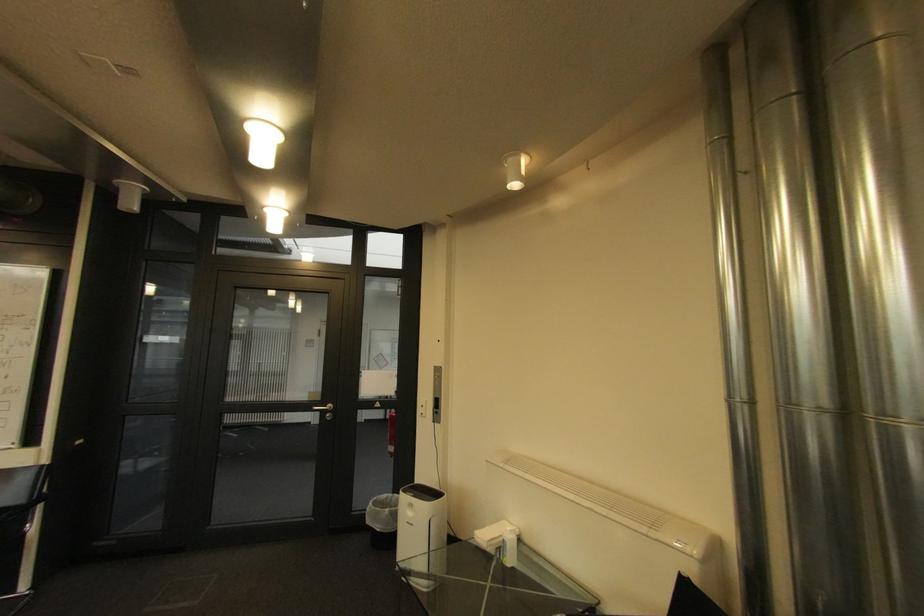
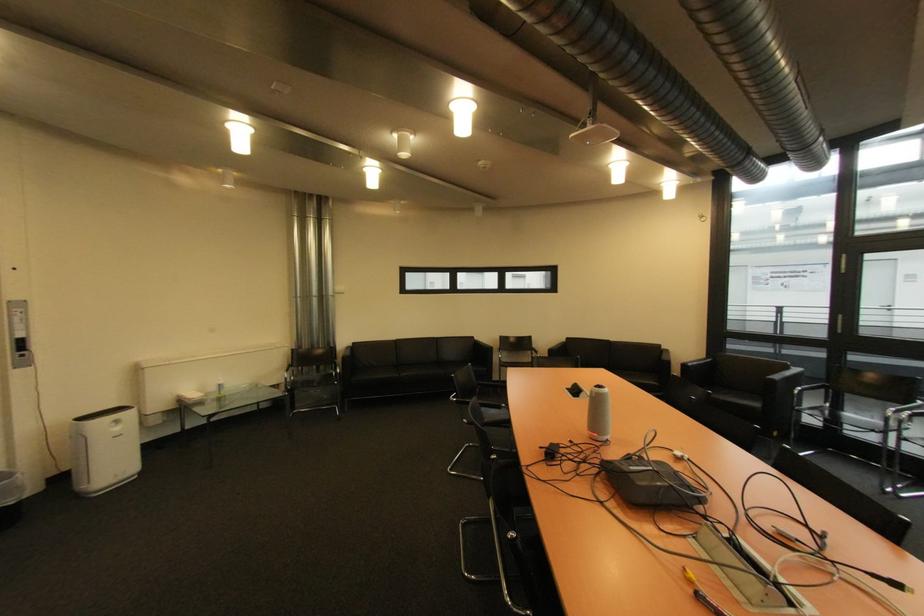
The point at (444, 414) is marked in the first image. Where is the corresponding point in the second image?

(30, 357)